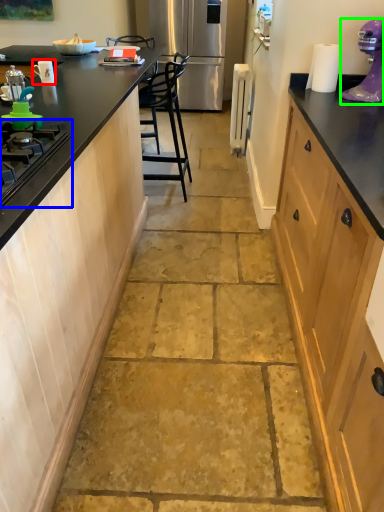
Question: Which is farther away from appliance (highlighted by a red box)? gas stove (highlighted by a blue box) or home appliance (highlighted by a green box)?

Choices:
 (A) gas stove
 (B) home appliance

Answer: (B)